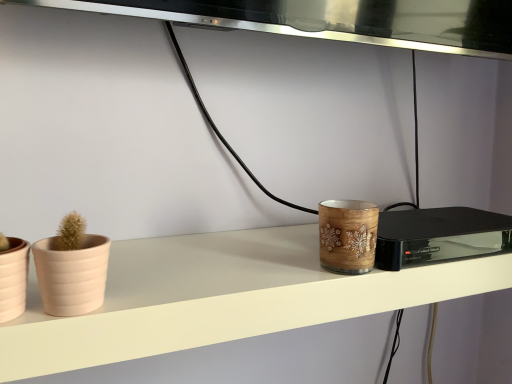
Identify the location of free space that is in between beige matte flowerpot at left, the first flowerpot from the right, and wooden candle holder at center. (238, 288).